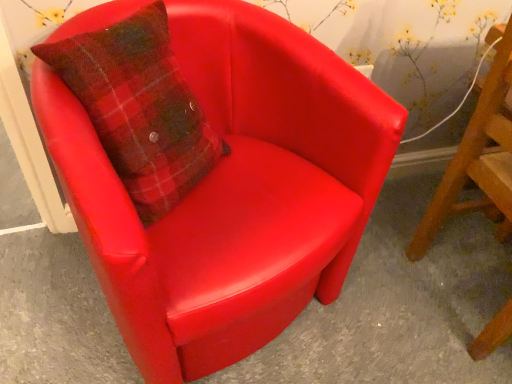
Question: Which direction should I rotate to look at matte red chair at center, acting as the second chair starting from the left, — up or down?

Choices:
 (A) down
 (B) up

Answer: (A)

Question: Does matte red chair at center, arranged as the 1th chair when viewed from the right, come in front of glossy leather chair at center?

Choices:
 (A) yes
 (B) no

Answer: (A)

Question: Is matte red chair at center, acting as the second chair starting from the left, aimed at glossy leather chair at center?

Choices:
 (A) yes
 (B) no

Answer: (B)

Question: From the image's perspective, would you say matte red chair at center, acting as the second chair starting from the left, is positioned over glossy leather chair at center?

Choices:
 (A) yes
 (B) no

Answer: (A)

Question: From the image's perspective, does matte red chair at center, arranged as the 1th chair when viewed from the right, appear lower than glossy leather chair at center?

Choices:
 (A) no
 (B) yes

Answer: (A)

Question: Considering the relative sizes of matte red chair at center, acting as the second chair starting from the left, and glossy leather chair at center in the image provided, is matte red chair at center, acting as the second chair starting from the left, bigger than glossy leather chair at center?

Choices:
 (A) yes
 (B) no

Answer: (A)

Question: Is the depth of matte red chair at center, acting as the second chair starting from the left, greater than that of glossy leather chair at center?

Choices:
 (A) yes
 (B) no

Answer: (B)

Question: Considering the relative sizes of glossy leather chair at center and matte red armchair at center, which is the second chair in right-to-left order, in the image provided, is glossy leather chair at center smaller than matte red armchair at center, which is the second chair in right-to-left order,?

Choices:
 (A) no
 (B) yes

Answer: (B)

Question: Could you tell me if glossy leather chair at center is turned towards matte red armchair at center, which is the 1th chair in left-to-right order?

Choices:
 (A) no
 (B) yes

Answer: (A)

Question: Is matte red armchair at center, which is the second chair in right-to-left order, inside glossy leather chair at center?

Choices:
 (A) yes
 (B) no

Answer: (B)

Question: Can you confirm if glossy leather chair at center is bigger than matte red armchair at center, which is the second chair in right-to-left order?

Choices:
 (A) no
 (B) yes

Answer: (A)

Question: Is glossy leather chair at center next to matte red armchair at center, which is the 1th chair in left-to-right order?

Choices:
 (A) no
 (B) yes

Answer: (A)

Question: From the image's perspective, is glossy leather chair at center located beneath matte red armchair at center, which is the second chair in right-to-left order?

Choices:
 (A) yes
 (B) no

Answer: (A)

Question: From a real-world perspective, is matte red armchair at center, which is the second chair in right-to-left order, on top of matte red chair at center, arranged as the 1th chair when viewed from the right?

Choices:
 (A) no
 (B) yes

Answer: (A)